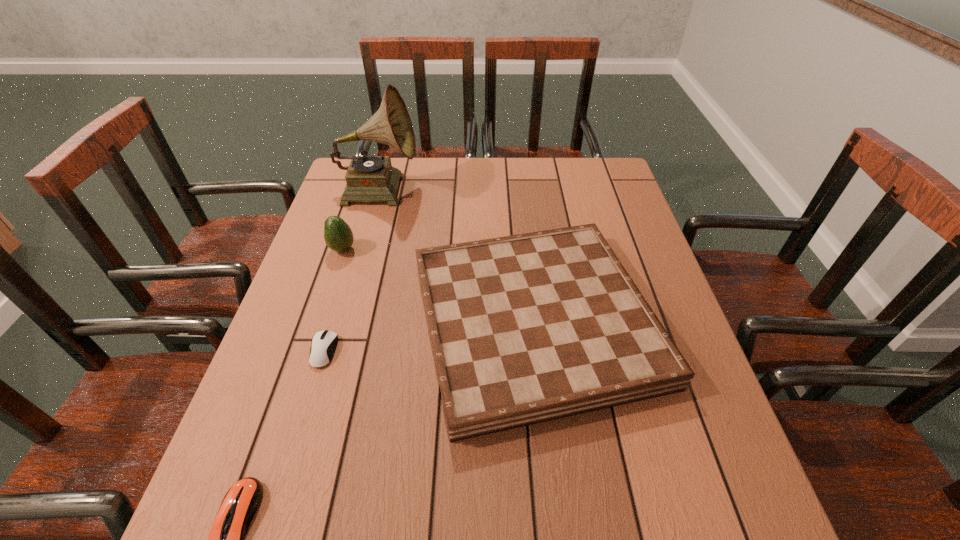
In the image, there is a desktop. Where is `vacant region at the far right corner`? This screenshot has width=960, height=540. vacant region at the far right corner is located at coordinates (585, 197).

The image size is (960, 540). In the image, there is a desktop. What are the coordinates of `vacant space at the near right corner` in the screenshot? It's located at pos(687,508).

In order to click on unoccupied area between the fourth shortest object and the right computer mouse in this screenshot , I will do `click(333, 300)`.

Locate an element on the screen. The width and height of the screenshot is (960, 540). free spot between the fourth shortest object and the farthest object is located at coordinates (361, 219).

Locate an element on the screen. The image size is (960, 540). free spot between the rightmost object and the farther computer mouse is located at coordinates (429, 336).

This screenshot has height=540, width=960. I want to click on the closest object to the right computer mouse, so click(528, 328).

The height and width of the screenshot is (540, 960). Find the location of `the third closest object to the farther computer mouse`. the third closest object to the farther computer mouse is located at coordinates (338, 236).

The width and height of the screenshot is (960, 540). In order to click on free location that satisfies the following two spatial constraints: 1. from the horn of the record player; 2. on the front side of the farther computer mouse in this screenshot , I will do `click(333, 351)`.

Identify the location of free space in the image that satisfies the following two spatial constraints: 1. on the front side of the avocado; 2. on the left side of the farther computer mouse. pyautogui.click(x=309, y=351).

Where is `free space that satisfies the following two spatial constraints: 1. from the horn of the tallest object; 2. on the right side of the third tallest object`? free space that satisfies the following two spatial constraints: 1. from the horn of the tallest object; 2. on the right side of the third tallest object is located at coordinates (342, 321).